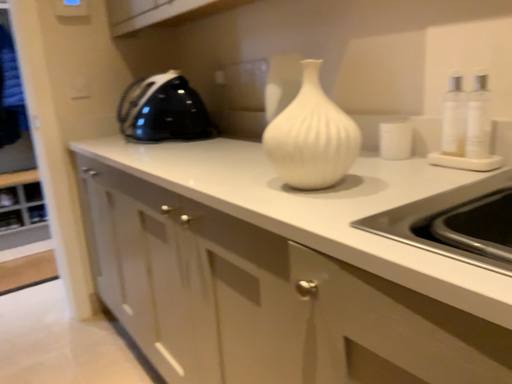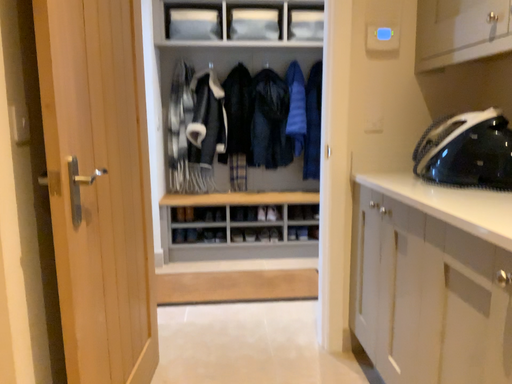
Question: How did the camera likely rotate when shooting the video?

Choices:
 (A) rotated right
 (B) rotated left

Answer: (B)